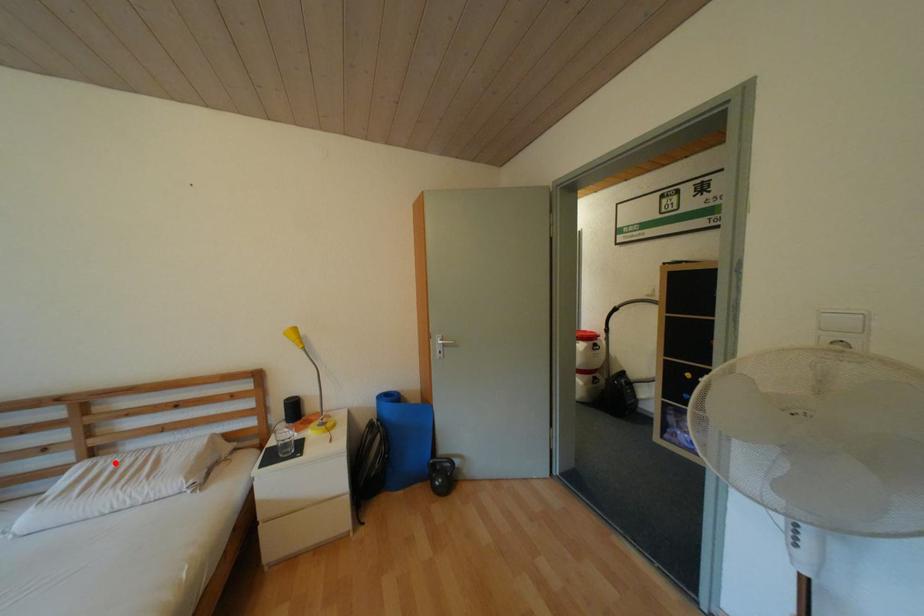
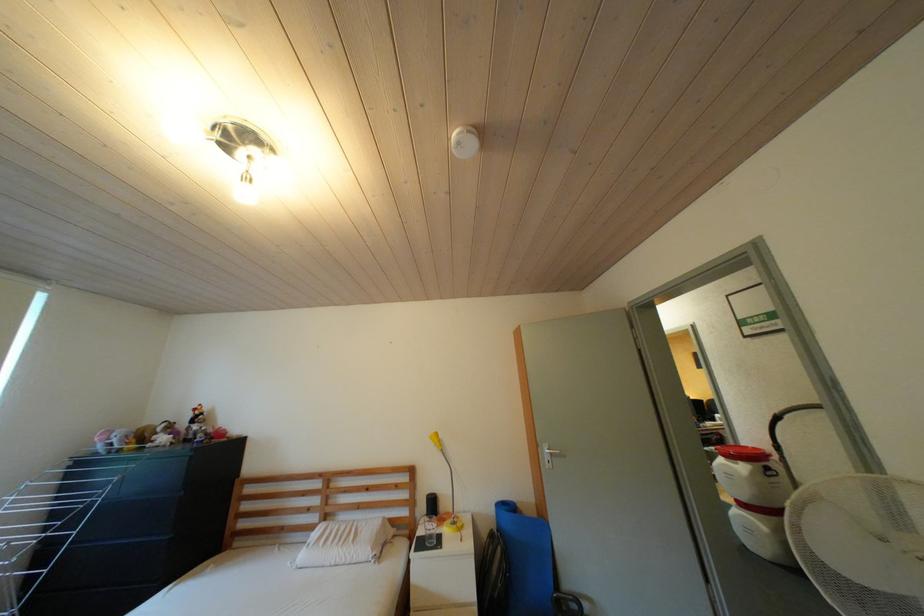
Question: I am providing you with two images of the same scene from different viewpoints. Image1 has a red point marked. In image2, the corresponding 3D location appears at what relative position? Reply with the corresponding letter.

Choices:
 (A) Closer
 (B) Farther

Answer: (B)